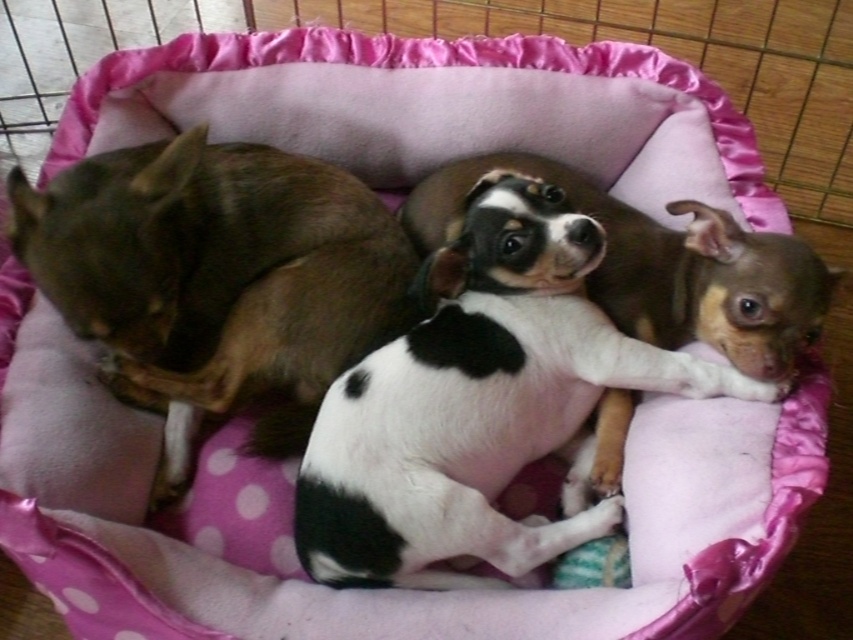
Question: Among these objects, which one is farthest from the camera?

Choices:
 (A) black and white fur at center
 (B) brown furry dog at left

Answer: (B)

Question: Which object is farther from the camera taking this photo?

Choices:
 (A) black and white fur at center
 (B) brown furry dog at left

Answer: (B)

Question: Observing the image, what is the correct spatial positioning of black and white fur at center in reference to brown furry dog at left?

Choices:
 (A) below
 (B) above

Answer: (A)

Question: Can you confirm if black and white fur at center is positioned to the left of brown furry dog at left?

Choices:
 (A) yes
 (B) no

Answer: (B)

Question: Is black and white fur at center wider than brown furry dog at left?

Choices:
 (A) yes
 (B) no

Answer: (A)